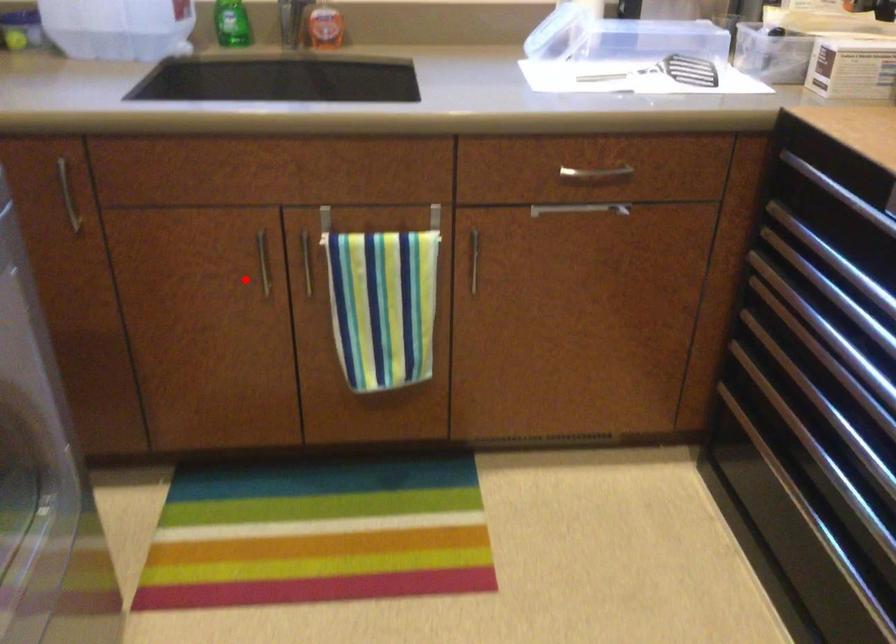
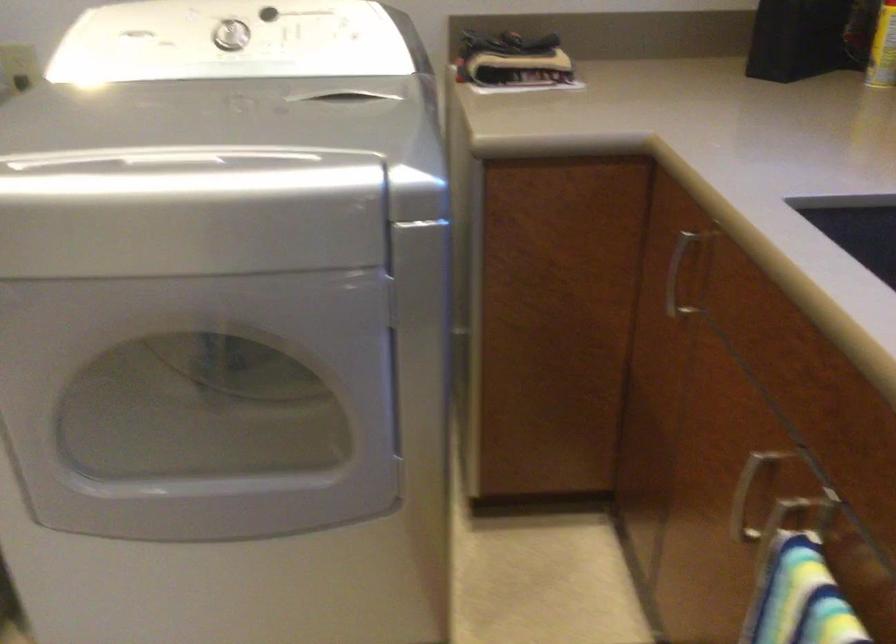
Question: I am providing you with two images of the same scene from different viewpoints. In image1, a red point is highlighted. Considering the same 3D point in image2, which of the following is correct?

Choices:
 (A) It is closer
 (B) It is farther

Answer: (A)